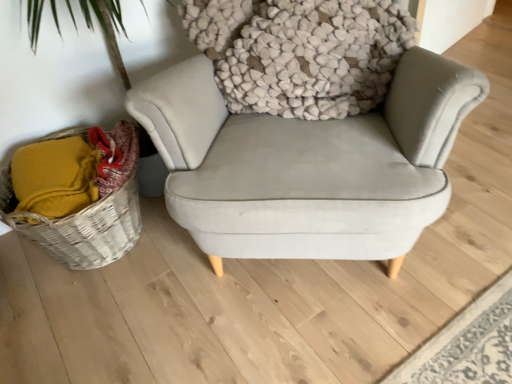
Question: Should I look upward or downward to see woven wicker basket at lower left?

Choices:
 (A) down
 (B) up

Answer: (A)